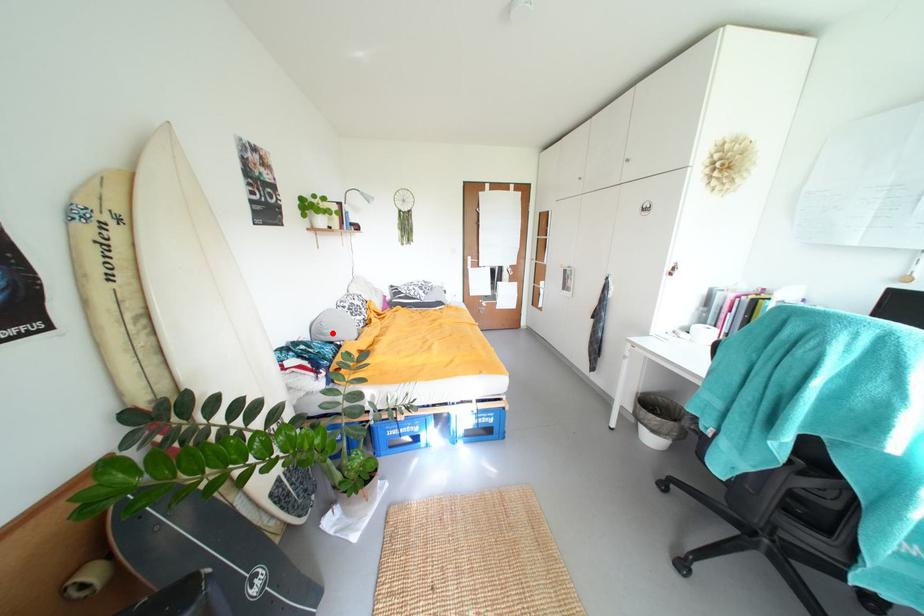
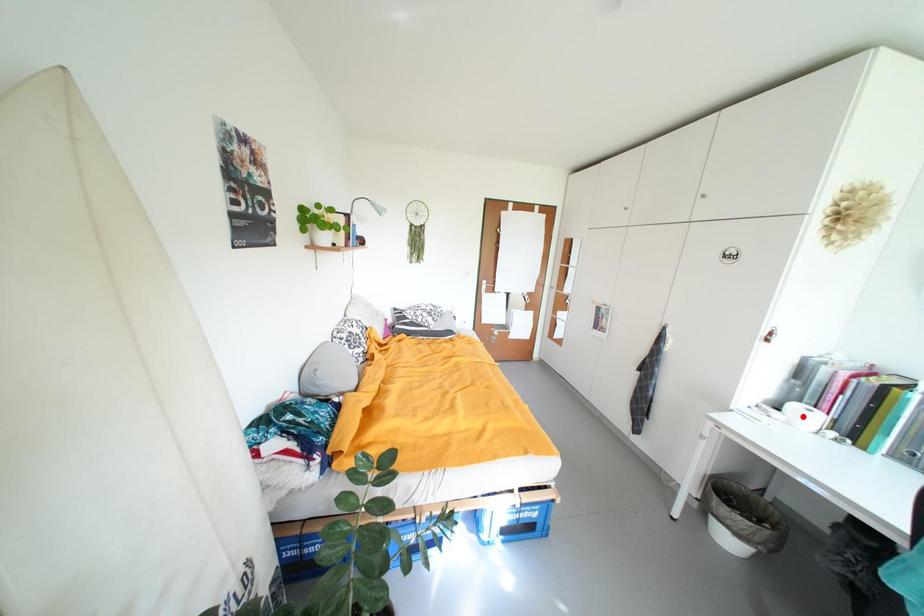
I am providing you with two images of the same scene from different viewpoints. A red point is marked on the first image and another point is marked on the second image. Is the marked point in image1 the same physical position as the marked point in image2?

No